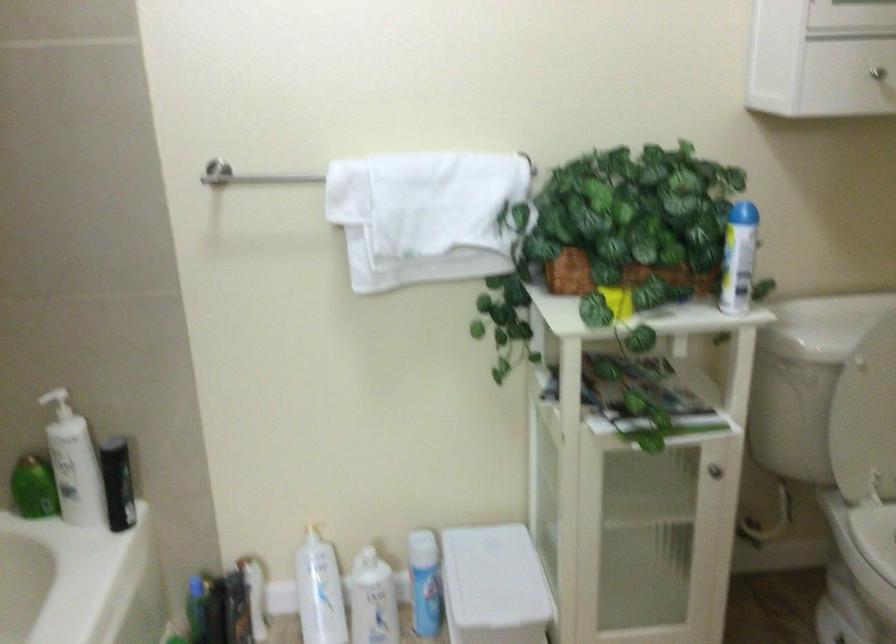
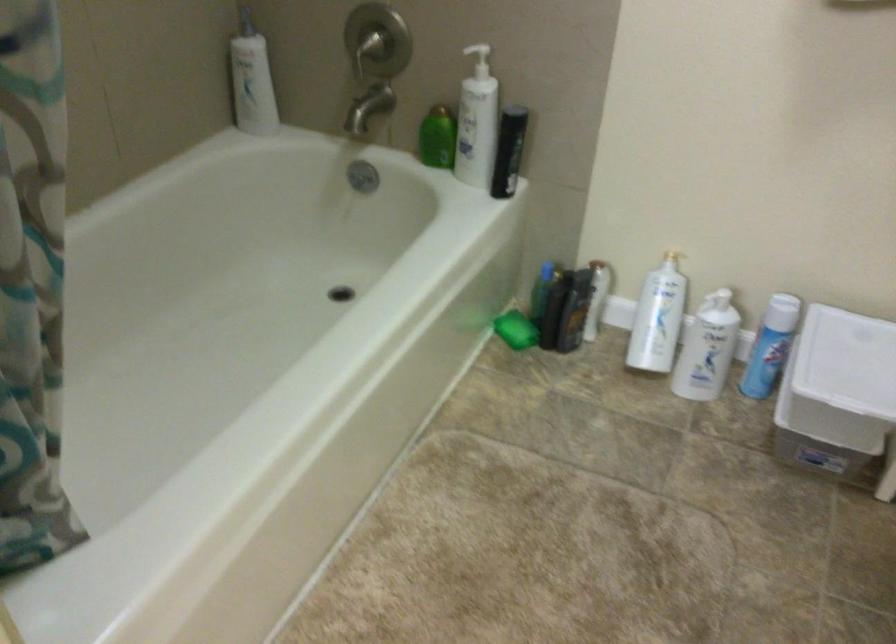
The first image is from the beginning of the video and the second image is from the end. How did the camera likely rotate when shooting the video?

The rotation direction of the camera is left-down.